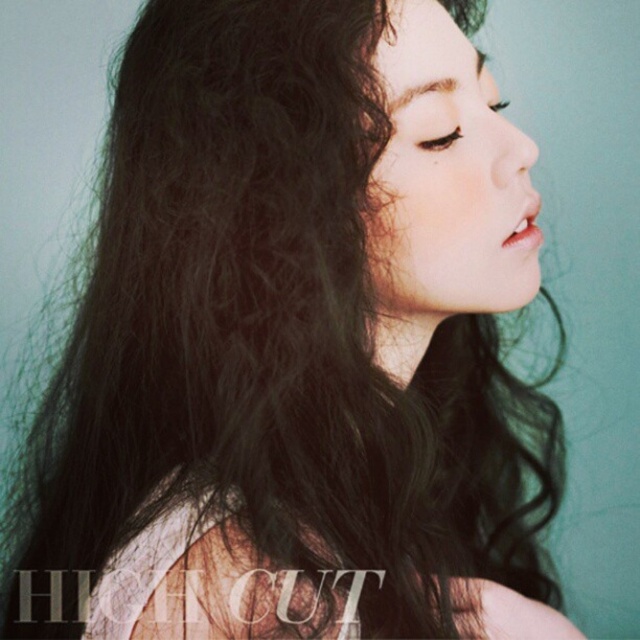
You are an artist analyzing the portrait. The image has two objects labeled as matte black eye at upper center and black matte eye at upper center. Which one is positioned lower in the image?

The matte black eye at upper center is positioned lower than the black matte eye at upper center according to the description.

You are an artist analyzing the portrait. You notice two eyes labeled as matte black eye at upper center and black matte eye at upper center. Which one is smaller in size?

The matte black eye at upper center is smaller in size compared to the black matte eye at upper center according to the description.